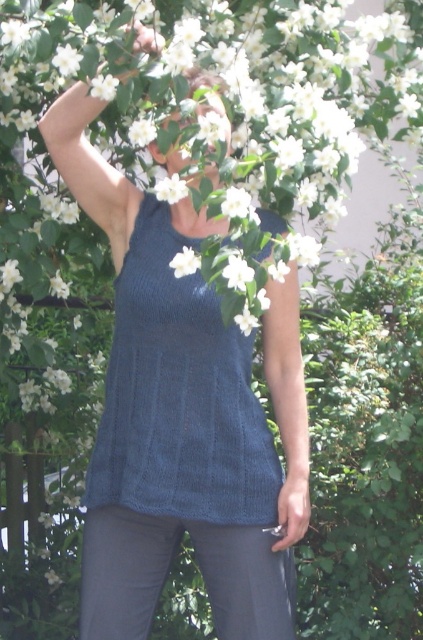
What do you see at coordinates (183, 417) in the screenshot? I see `knitted blue tank top at center` at bounding box center [183, 417].

Locate an element on the screen. knitted blue tank top at center is located at coordinates (183, 417).

Find the location of a particular element. The width and height of the screenshot is (423, 640). knitted blue vest at center is located at coordinates (178, 396).

Does knitted blue vest at center appear over smooth skin head at center?

No.

Locate an element on the screen. Image resolution: width=423 pixels, height=640 pixels. knitted blue vest at center is located at coordinates (178, 396).

Is knitted blue tank top at center below smooth skin head at center?

Indeed, knitted blue tank top at center is positioned under smooth skin head at center.

Which of these two, knitted blue tank top at center or smooth skin head at center, stands taller?

knitted blue tank top at center is taller.

Which is behind, point (178, 406) or point (214, 100)?

The point (178, 406) is behind.

At what (x,y) coordinates should I click in order to perform the action: click on knitted blue tank top at center. Please return your answer as a coordinate pair (x, y). Image resolution: width=423 pixels, height=640 pixels. Looking at the image, I should click on (183, 417).